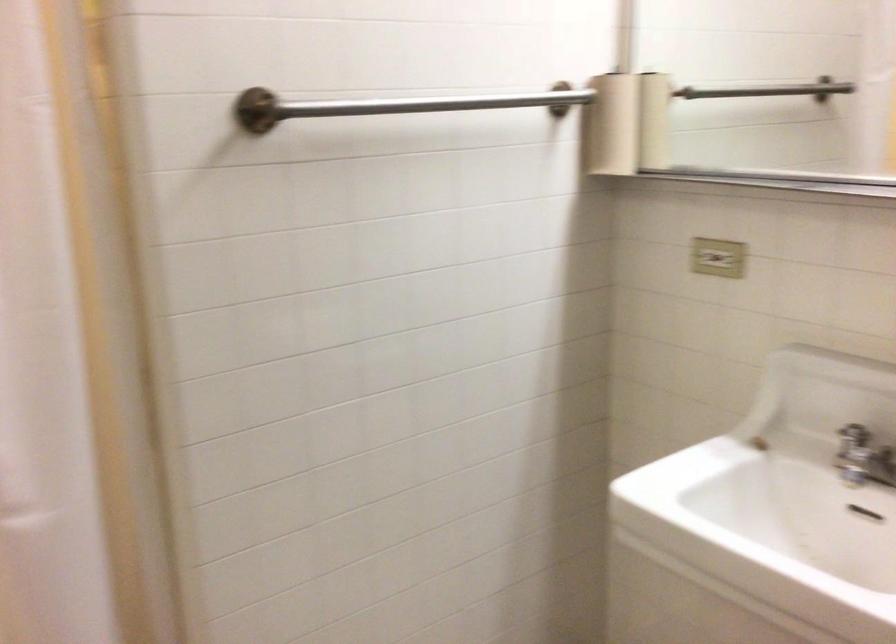
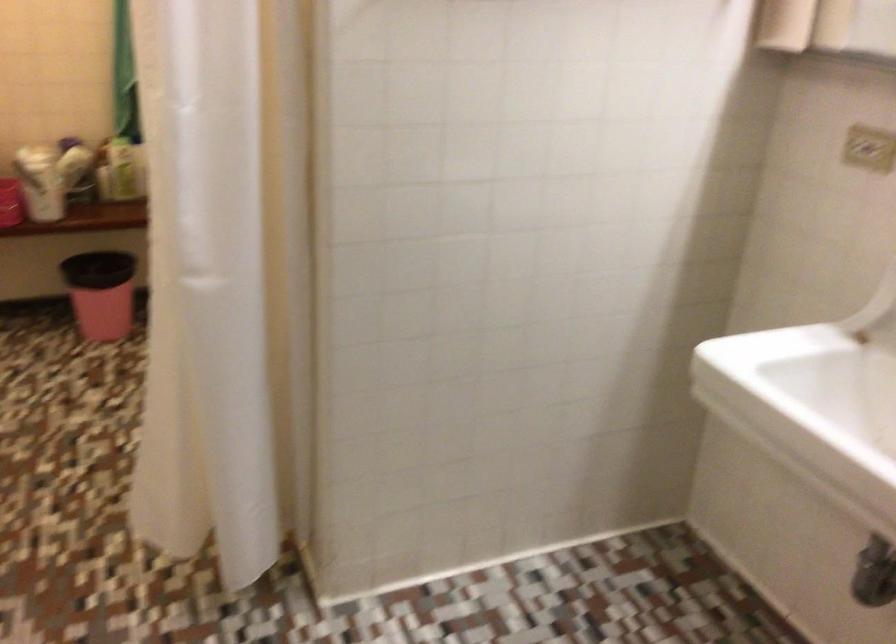
Find the pixel in the second image that matches point (719, 254) in the first image.

(867, 147)